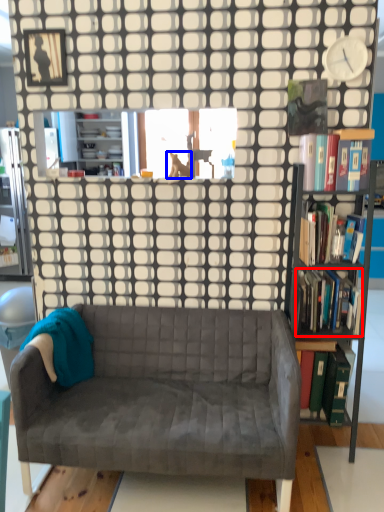
Question: Which object appears farthest to the camera in this image, book (highlighted by a red box) or animal (highlighted by a blue box)?

Choices:
 (A) book
 (B) animal

Answer: (B)